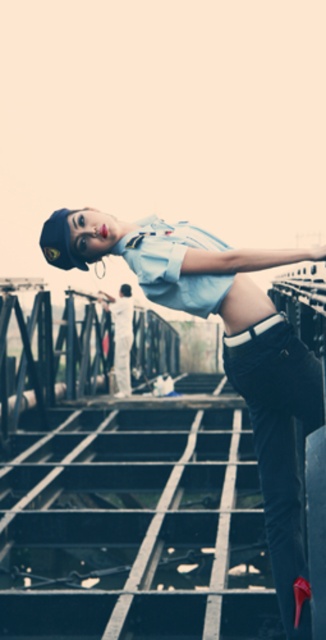
You are standing on the railway bridge and see the light blue uniform at center and the velvet black pants at lower right. Which object is closer to you?

The light blue uniform at center is closer to you because it is positioned further to the viewer than the velvet black pants at lower right.

Based on the coordinates provided, where is the light blue uniform at center located in the image?

The light blue uniform at center is located at the 2D coordinates point (223, 349) in the image.